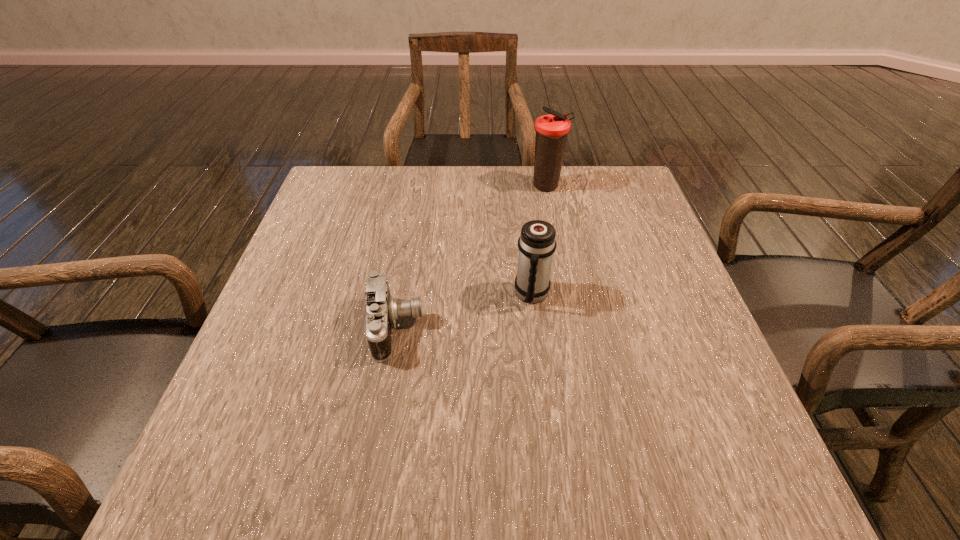
Where is `free space that is in between the farthest object and the shortest object`? free space that is in between the farthest object and the shortest object is located at coordinates (471, 257).

This screenshot has width=960, height=540. I want to click on unoccupied area between the nearer thermos bottle and the shortest object, so click(464, 311).

Image resolution: width=960 pixels, height=540 pixels. I want to click on blank region between the shortest object and the taller thermos bottle, so click(x=471, y=257).

Locate an element on the screen. blank region between the second tallest object and the camera is located at coordinates (464, 311).

The height and width of the screenshot is (540, 960). Find the location of `free space between the camera and the farther thermos bottle`. free space between the camera and the farther thermos bottle is located at coordinates (471, 257).

Identify which object is located as the second nearest to the nearer thermos bottle. Please provide its 2D coordinates. Your answer should be formatted as a tuple, i.e. [(x, y)], where the tuple contains the x and y coordinates of a point satisfying the conditions above.

[(551, 130)]

Find the location of a particular element. The width and height of the screenshot is (960, 540). object that is the closest to the tallest object is located at coordinates (537, 243).

Where is `vacant area that satisfies the following two spatial constraints: 1. on the side with the handle of the second tallest object; 2. at the lens of the leftmost object`? vacant area that satisfies the following two spatial constraints: 1. on the side with the handle of the second tallest object; 2. at the lens of the leftmost object is located at coordinates (536, 328).

Where is `free location that satisfies the following two spatial constraints: 1. on the front side of the farther thermos bottle; 2. at the lens of the leftmost object`? free location that satisfies the following two spatial constraints: 1. on the front side of the farther thermos bottle; 2. at the lens of the leftmost object is located at coordinates (573, 328).

Locate an element on the screen. vacant space that satisfies the following two spatial constraints: 1. on the front side of the tallest object; 2. at the lens of the shortest object is located at coordinates click(573, 328).